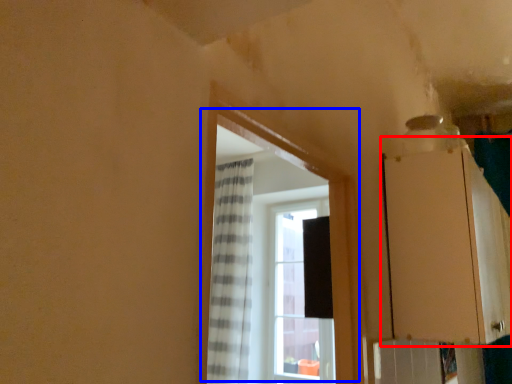
Question: Among these objects, which one is farthest to the camera, cabinetry (highlighted by a red box) or window (highlighted by a blue box)?

Choices:
 (A) cabinetry
 (B) window

Answer: (A)